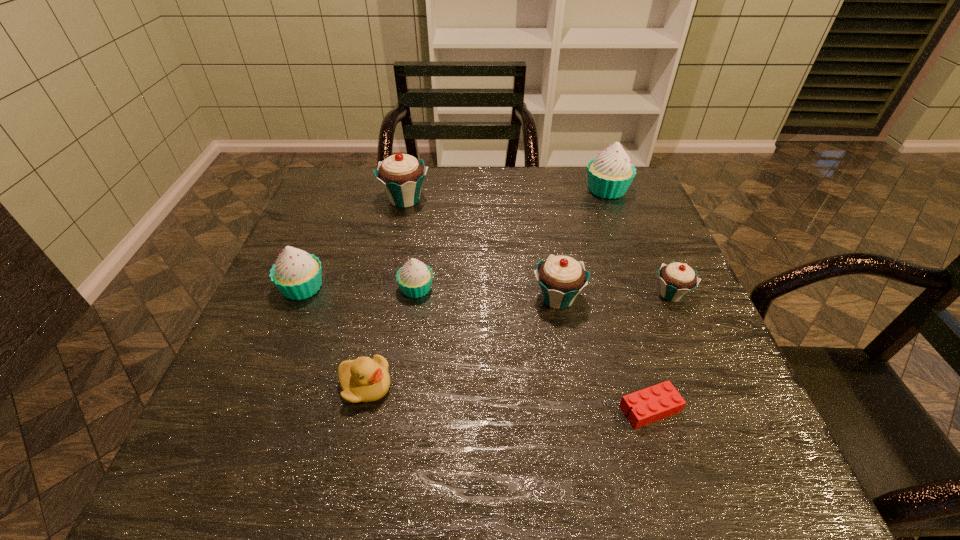
Where is `yellow duckling`? This screenshot has height=540, width=960. yellow duckling is located at coordinates (364, 379).

Locate an element on the screen. Image resolution: width=960 pixels, height=540 pixels. red Lego is located at coordinates (657, 402).

Locate an element on the screen. The width and height of the screenshot is (960, 540). the shortest object is located at coordinates (657, 402).

Image resolution: width=960 pixels, height=540 pixels. I want to click on free space located on the left of the biggest white cupcake, so click(x=502, y=190).

You are a GUI agent. You are given a task and a screenshot of the screen. Output one action in this format:
    pyautogui.click(x=<x>, y=<y>)
    Task: Click on the free location located on the right of the leftmost teal cupcake
    The width and height of the screenshot is (960, 540).
    Given the screenshot: What is the action you would take?
    pyautogui.click(x=553, y=200)

The height and width of the screenshot is (540, 960). In order to click on free space located 0.280m on the right of the leftmost object in this screenshot , I will do `click(448, 287)`.

Identify the location of vacant point located on the back of the second smallest teal cupcake. (547, 237).

Image resolution: width=960 pixels, height=540 pixels. I want to click on vacant space situated 0.320m on the right of the second white cupcake from right to left, so click(x=574, y=288).

Locate an element on the screen. The image size is (960, 540). vacant space located on the front of the smallest teal cupcake is located at coordinates (742, 458).

Identify the location of vacant area located 0.230m on the beak of the yellow duckling. The image size is (960, 540). (515, 386).